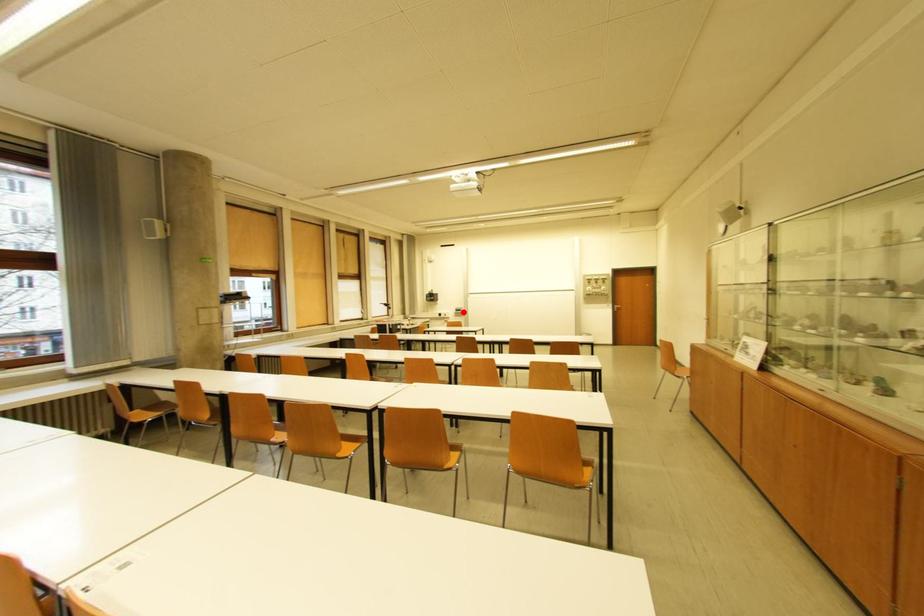
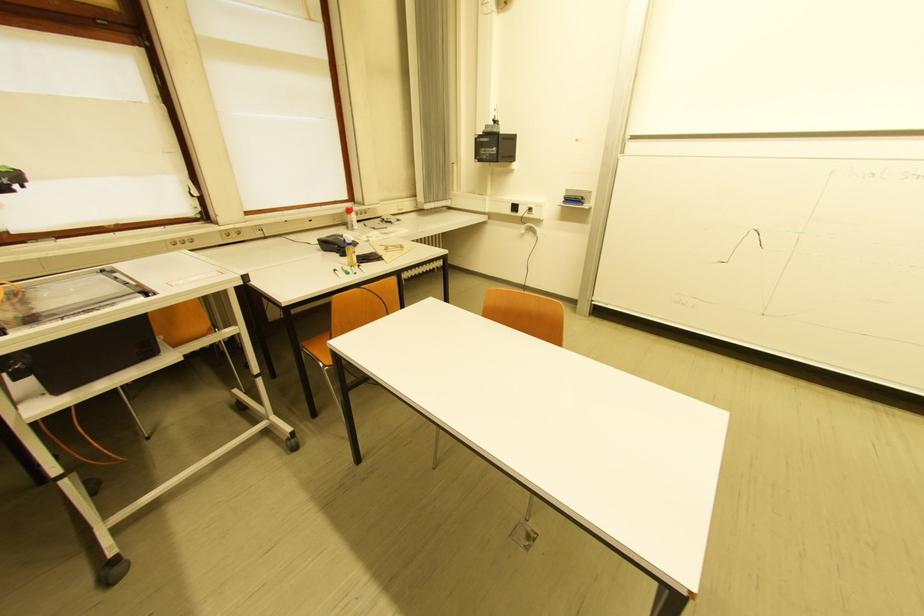
Question: I am providing you with two images of the same scene from different viewpoints. A red point is shown in image1. For the corresponding object point in image2, is it positioned nearer or farther from the camera?

Choices:
 (A) Nearer
 (B) Farther

Answer: (A)